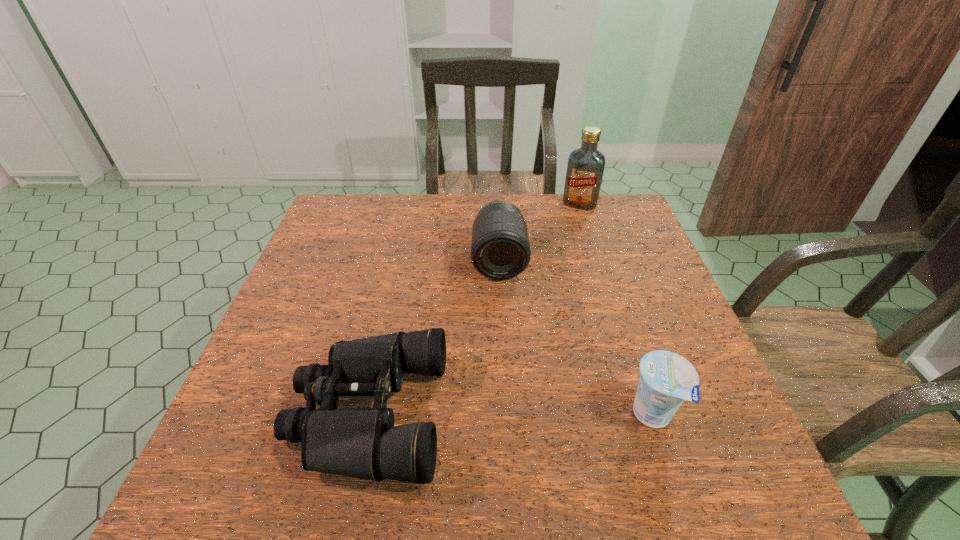
Identify the location of vacant space at the near right corner of the desktop. (708, 416).

Locate an element on the screen. vacant space in between the yogurt and the tallest object is located at coordinates (616, 309).

The width and height of the screenshot is (960, 540). I want to click on vacant point located between the leftmost object and the second shortest object, so click(x=510, y=414).

Where is `vacant region between the binoculars and the farthest object`? The image size is (960, 540). vacant region between the binoculars and the farthest object is located at coordinates (473, 308).

Identify the location of blank region between the farthest object and the binoculars. (473, 308).

Locate an element on the screen. The width and height of the screenshot is (960, 540). vacant region between the third tallest object and the tallest object is located at coordinates (616, 309).

The height and width of the screenshot is (540, 960). I want to click on free spot between the yogurt and the binoculars, so 510,414.

This screenshot has height=540, width=960. I want to click on free space between the leftmost object and the farthest object, so click(473, 308).

Locate an element on the screen. The height and width of the screenshot is (540, 960). vacant space in between the yogurt and the third object from right to left is located at coordinates (576, 338).

Where is `free space between the tallest object and the second farthest object`? free space between the tallest object and the second farthest object is located at coordinates (540, 232).